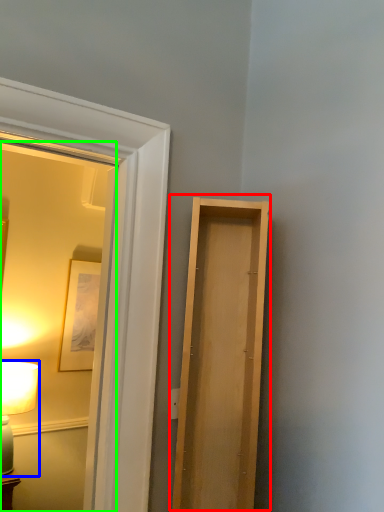
Question: Which object is the farthest from door (highlighted by a red box)? Choose among these: table lamp (highlighted by a blue box) or mirror (highlighted by a green box).

Choices:
 (A) table lamp
 (B) mirror

Answer: (B)